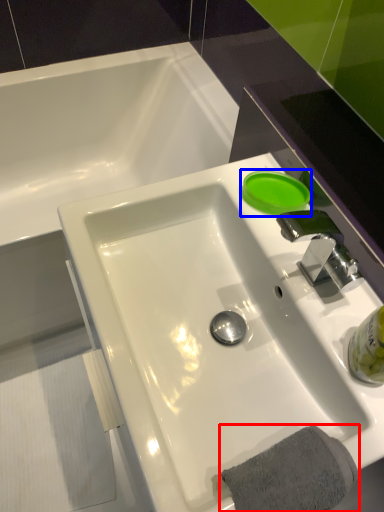
Question: Which of the following is the closest to the observer, bath towel (highlighted by a red box) or liquid (highlighted by a blue box)?

Choices:
 (A) bath towel
 (B) liquid

Answer: (A)